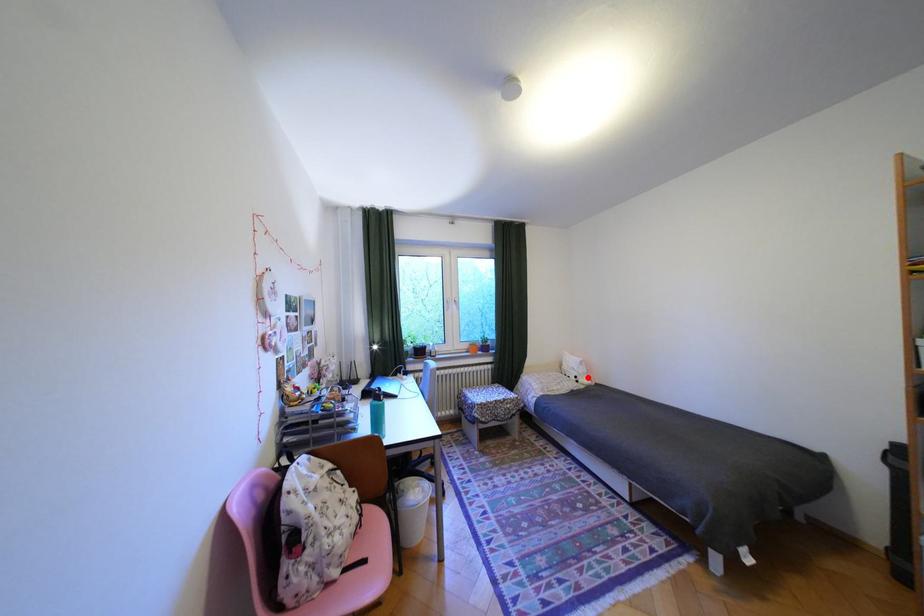
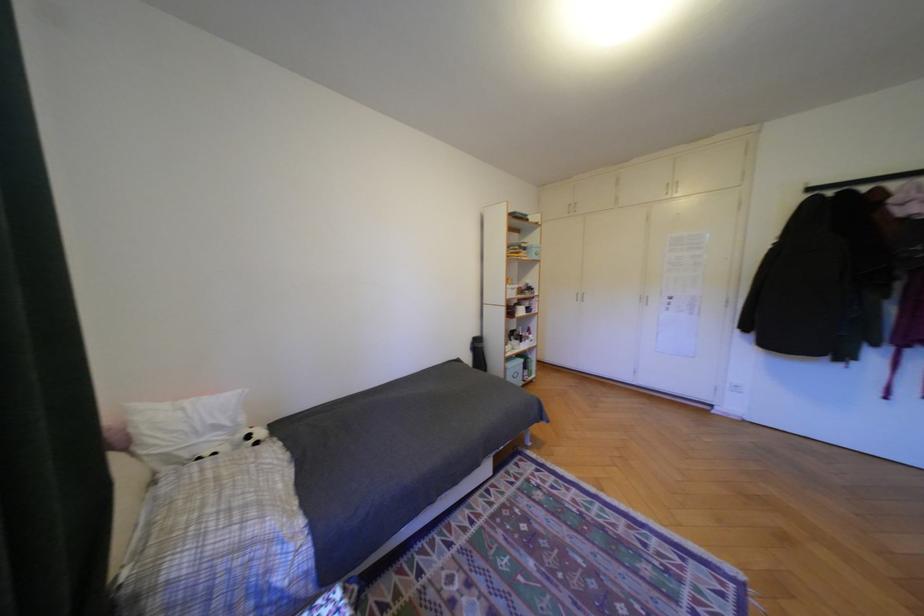
Question: A red point is marked in image1. In image2, is the corresponding 3D point closer to the camera or farther? Reply with the corresponding letter.

Choices:
 (A) The corresponding 3D point is closer.
 (B) The corresponding 3D point is farther.

Answer: (A)